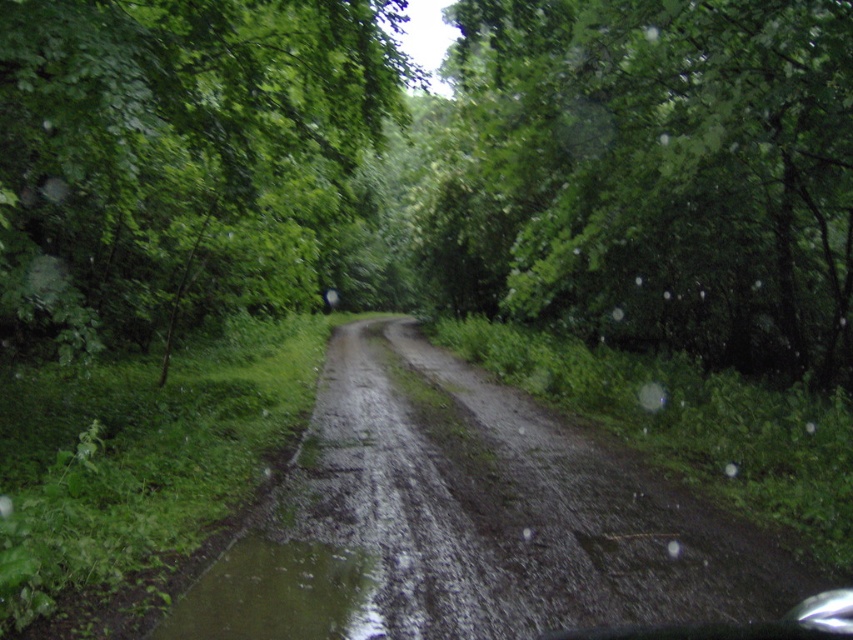
You are driving a car and see the damp gravel path at center and the green mud puddle at lower left. Which one is closer to your car?

The damp gravel path at center is closer to your car because the green mud puddle at lower left is behind it.

You are driving a car with a width of 1.8 meters along a narrow road through a dense forest. The damp gravel path at center is the only path available. Given the path is at coordinates point 0.816, 0.550, can your car safely navigate through it without going off the road?

The damp gravel path at center is positioned at point (x=468, y=522). Since the path is the only available route and the car is 1.8 meters wide, the car can navigate through the path as long as the path width accommodates the car. However, the provided information does not specify the path width, so it is uncertain whether the car can safely pass without going off the road.

In the scene shown: You are driving a car with a 5 meter long trailer attached. You see the green leafy tree at upper center in your rearview mirror. Can you safely back up your car and trailer without hitting the tree?

The distance between the green leafy tree at upper center and the camera is 8.48 meters. Since the trailer is 5 meters long, when backing up, the total length of the car and trailer would need at least 5 meters of space. Since 8.48 meters is greater than 5 meters, there is enough space to safely back up without hitting the tree.